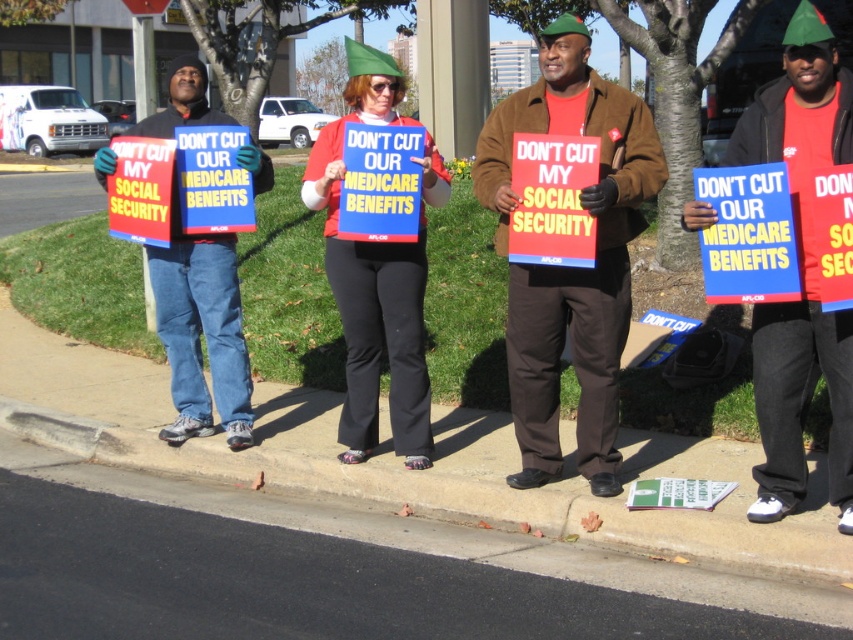
From the picture: You are a photographer standing at the edge of the sidewalk where the protest is happening. You want to take a photo of the red fabric sign at center from a distance that ensures the sign is clearly visible without any distortion. Considering the recommended minimum distance for such signs is 3 meters, can you take the photo from your current position?

The red fabric sign at center and viewer are 4.30 meters apart from each other. Since the recommended minimum distance is 3 meters, you can take the photo from your current position as you are already beyond the required distance.

You are a photographer trying to capture a clear shot of the matte brown jacket at center. Based on the scene description, where should you position your camera relative to the group to ensure the jacket is in the frame?

The matte brown jacket at center is located at point [566,266], so positioning the camera at the center of the scene would ensure the jacket is in the frame.

Based on the photo, you are a photographer trying to capture a clear shot of the red fabric sign at center without the matte brown jacket at center blocking it. What adjustment should you make to your camera angle?

The matte brown jacket at center is located above the red fabric sign at center. To avoid blocking the sign, lower your camera angle so that the jacket is out of frame while keeping the sign visible.